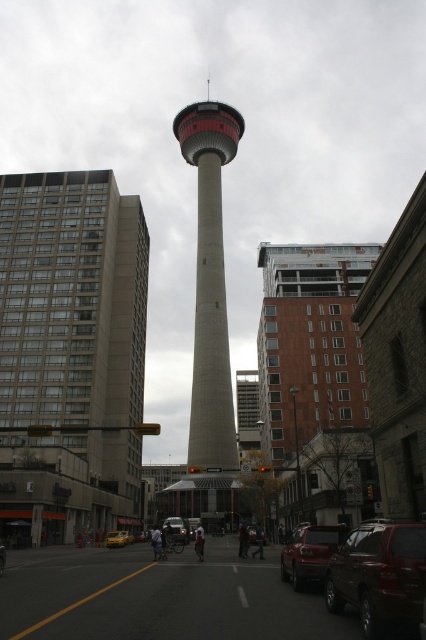
Question: Which point is farther to the camera?

Choices:
 (A) concrete tower at center
 (B) matte red suv at center

Answer: (A)

Question: In this image, where is matte red suv at center located relative to yellow matte car at center?

Choices:
 (A) above
 (B) below

Answer: (A)

Question: Based on their relative distances, which object is farther from the concrete tower at center?

Choices:
 (A) satin silver suv at center
 (B) matte red suv at center

Answer: (A)

Question: Considering the relative positions of concrete building at left and matte red suv at center in the image provided, where is concrete building at left located with respect to matte red suv at center?

Choices:
 (A) above
 (B) below

Answer: (A)

Question: Is matte red suv at center thinner than shiny black car at center?

Choices:
 (A) yes
 (B) no

Answer: (B)

Question: Which object appears closest to the camera in this image?

Choices:
 (A) satin silver suv at center
 (B) concrete building at left
 (C) shiny black car at center
 (D) concrete tower at center

Answer: (A)